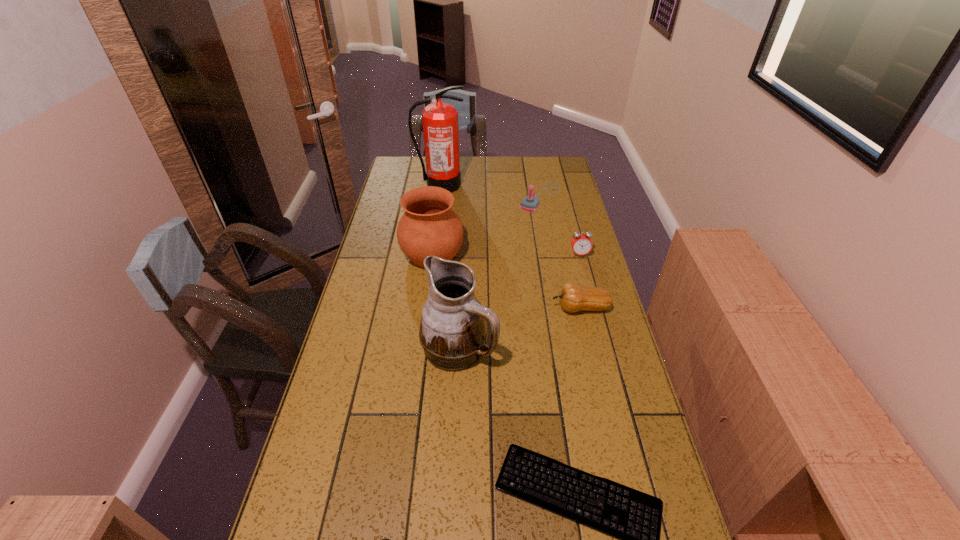
This screenshot has width=960, height=540. What are the coordinates of `free point between the joystick and the second tallest object` in the screenshot? It's located at (500, 272).

At what (x,y) coordinates should I click in order to perform the action: click on empty space that is in between the alarm clock and the third nearest object. Please return your answer as a coordinate pair (x, y). The width and height of the screenshot is (960, 540). Looking at the image, I should click on (519, 301).

Select which object is the seventh closest to the third nearest object. Please provide its 2D coordinates. Your answer should be formatted as a tuple, i.e. [(x, y)], where the tuple contains the x and y coordinates of a point satisfying the conditions above.

[(440, 120)]

Select which object appears as the second closest to the computer keyboard. Please provide its 2D coordinates. Your answer should be formatted as a tuple, i.e. [(x, y)], where the tuple contains the x and y coordinates of a point satisfying the conditions above.

[(453, 332)]

At what (x,y) coordinates should I click in order to perform the action: click on vacant space that satisfies the following two spatial constraints: 1. on the front side of the fire extinguisher; 2. on the left side of the sixth shortest object. Please return your answer as a coordinate pair (x, y). The image size is (960, 540). Looking at the image, I should click on (431, 255).